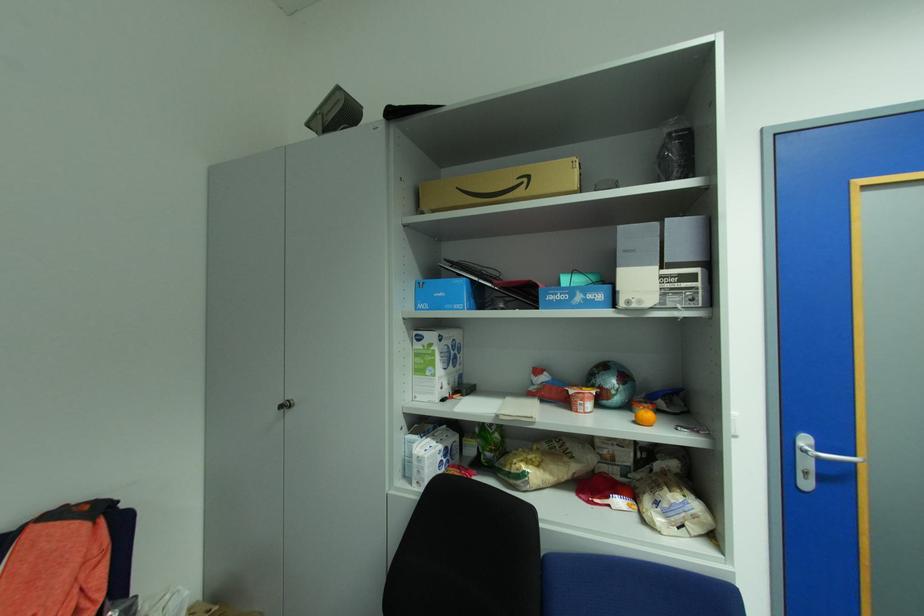
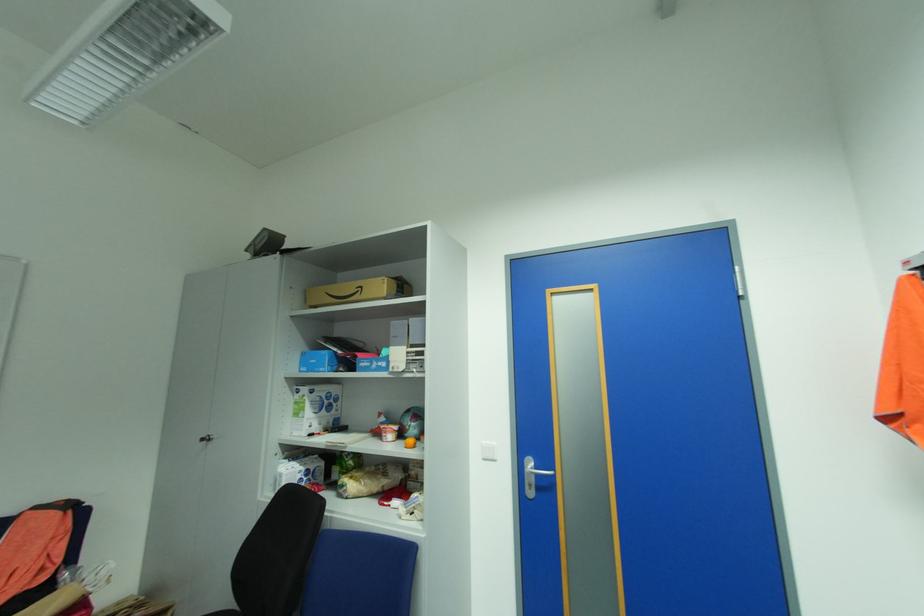
The point at (535, 177) is marked in the first image. Where is the corresponding point in the second image?

(368, 286)